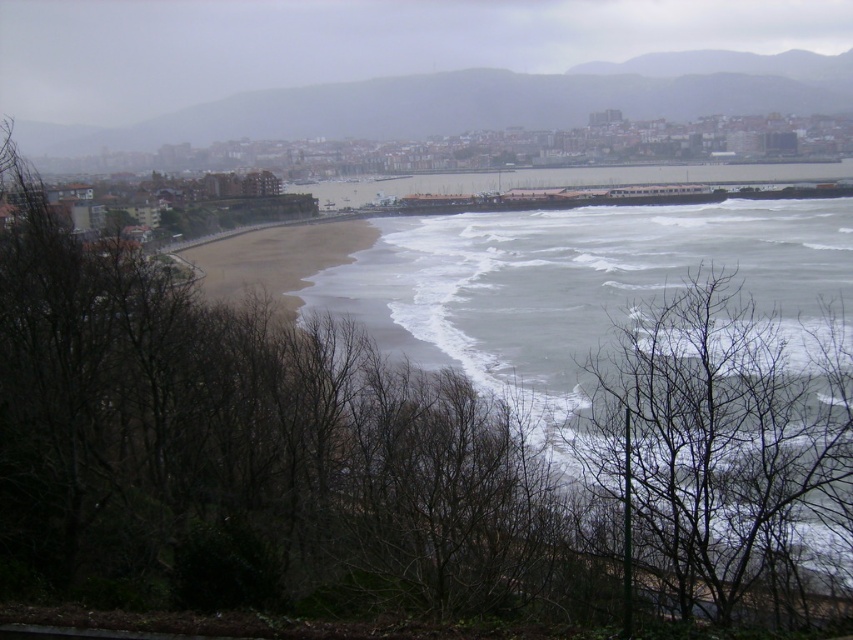
Does gray/foamy water at center have a smaller size compared to bare branches at lower right?

Incorrect, gray/foamy water at center is not smaller in size than bare branches at lower right.

Is gray/foamy water at center further to the viewer compared to bare branches at lower right?

No, it is in front of bare branches at lower right.

Between point (682, 586) and point (747, 595), which one is positioned in front?

Point (747, 595) is more forward.

Locate an element on the screen. Image resolution: width=853 pixels, height=640 pixels. gray/foamy water at center is located at coordinates (651, 371).